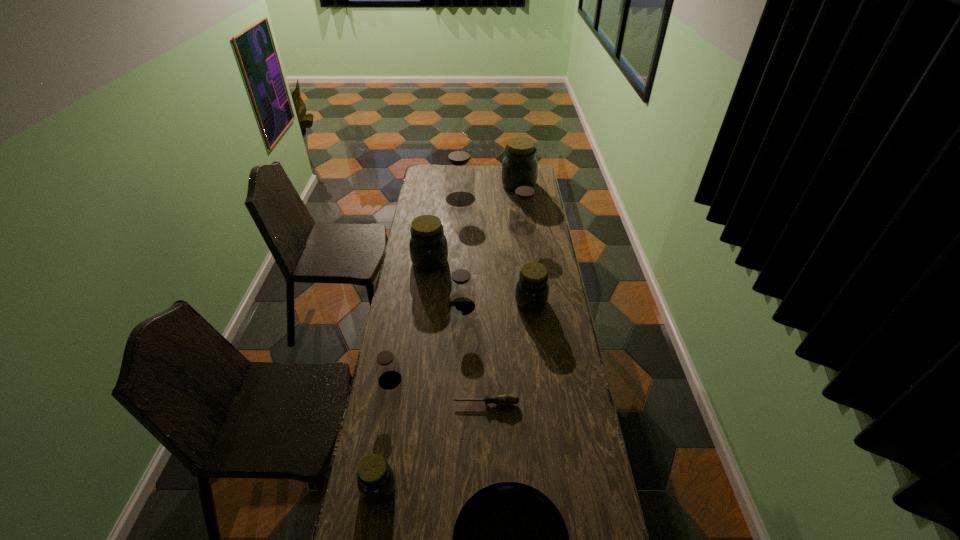
At what (x,y) coordinates should I click in order to perform the action: click on vacant space situated on the right of the nearest brown jar. Please return your answer as a coordinate pair (x, y). Looking at the image, I should click on (445, 380).

The height and width of the screenshot is (540, 960). I want to click on vacant space situated on the right of the nearest green jar, so click(x=460, y=488).

At what (x,y) coordinates should I click in order to perform the action: click on vacant space located 0.200m at the tip of the third nearest object. Please return your answer as a coordinate pair (x, y). Looking at the image, I should click on (396, 403).

Image resolution: width=960 pixels, height=540 pixels. I want to click on free space located at the tip of the third nearest object, so click(373, 403).

Locate an element on the screen. free space located at the tip of the third nearest object is located at coordinates (436, 403).

At what (x,y) coordinates should I click in order to perform the action: click on object that is positioned at the far edge. Please return your answer as a coordinate pair (x, y). The image size is (960, 540). Looking at the image, I should click on (519, 167).

I want to click on object that is positioned at the far right corner, so click(x=519, y=167).

In the image, there is a desktop. At what (x,y) coordinates should I click in order to perform the action: click on vacant space at the far edge. Please return your answer as a coordinate pair (x, y). The height and width of the screenshot is (540, 960). Looking at the image, I should click on (480, 176).

This screenshot has width=960, height=540. I want to click on free region at the left edge, so click(x=406, y=496).

This screenshot has width=960, height=540. In the image, there is a desktop. Identify the location of vacant space at the right edge. (535, 258).